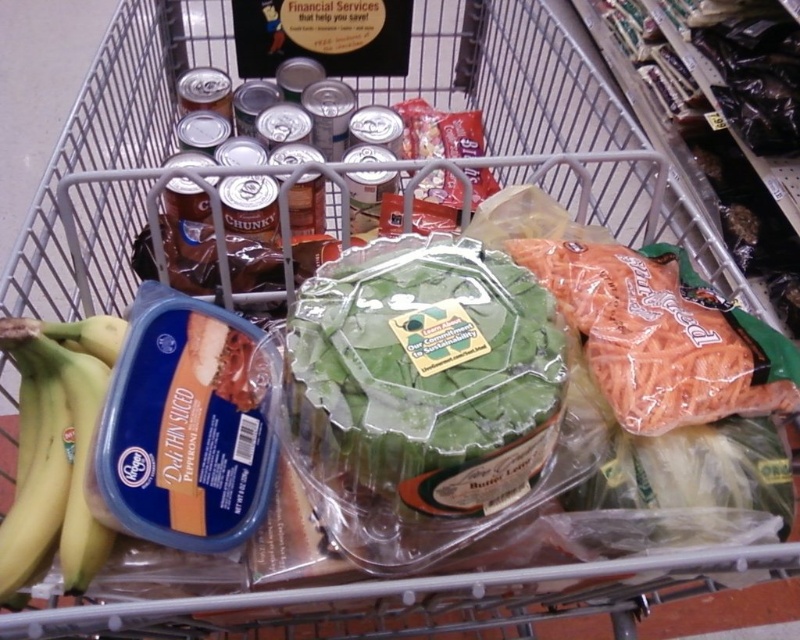
Does green leafy lettuce at center have a lesser height compared to yellow matte bananas at left?

No, green leafy lettuce at center is not shorter than yellow matte bananas at left.

Who is taller, green leafy lettuce at center or yellow matte bananas at left?

With more height is green leafy lettuce at center.

Does point (552, 362) lie behind point (2, 326)?

No.

Where is `green leafy lettuce at center`? Image resolution: width=800 pixels, height=640 pixels. green leafy lettuce at center is located at coordinates (425, 374).